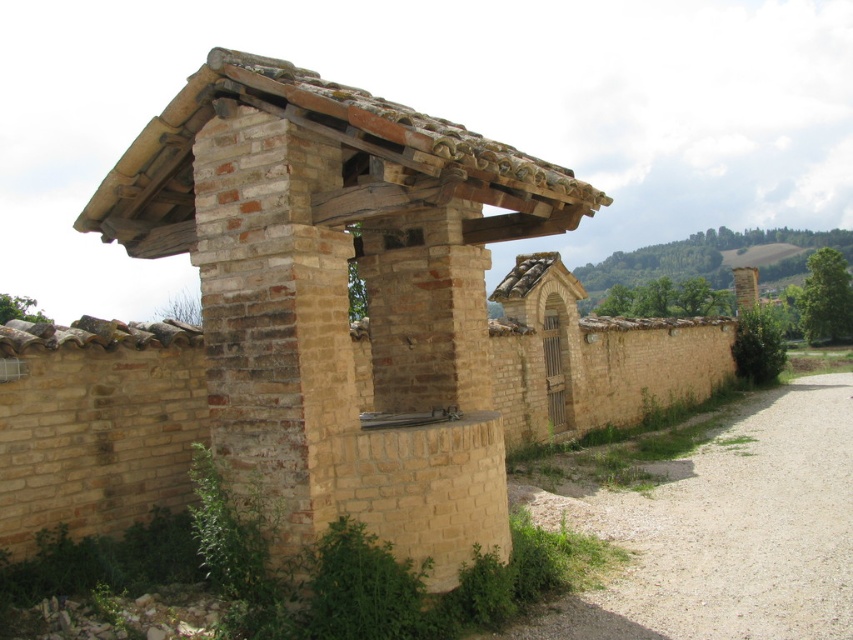
Question: Which point is closer to the camera?

Choices:
 (A) brick/rough stone hut at center
 (B) gravelly dirt path at lower right

Answer: (A)

Question: Can you confirm if brick/rough stone hut at center is thinner than gravelly dirt path at lower right?

Choices:
 (A) yes
 (B) no

Answer: (A)

Question: Which point appears closest to the camera in this image?

Choices:
 (A) coord(779,628)
 (B) coord(282,67)

Answer: (A)

Question: Can you confirm if brick/rough stone hut at center is positioned to the right of gravelly dirt path at lower right?

Choices:
 (A) yes
 (B) no

Answer: (B)

Question: Is the position of brick/rough stone hut at center more distant than that of gravelly dirt path at lower right?

Choices:
 (A) yes
 (B) no

Answer: (B)